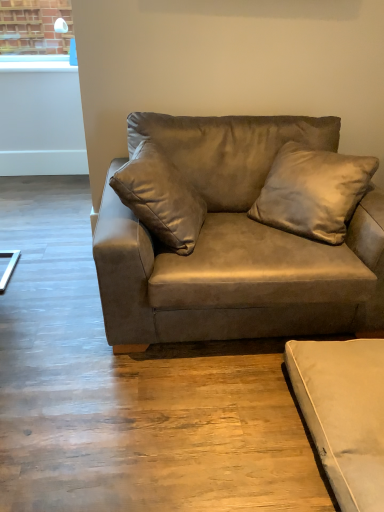
Find the location of `free space that is in between beige suede studio couch at lower right, which appears as the 2th studio couch when viewed from the top, and suede brown couch at center, which is the 2th studio couch in bottom-to-top order`. free space that is in between beige suede studio couch at lower right, which appears as the 2th studio couch when viewed from the top, and suede brown couch at center, which is the 2th studio couch in bottom-to-top order is located at coordinates (231, 406).